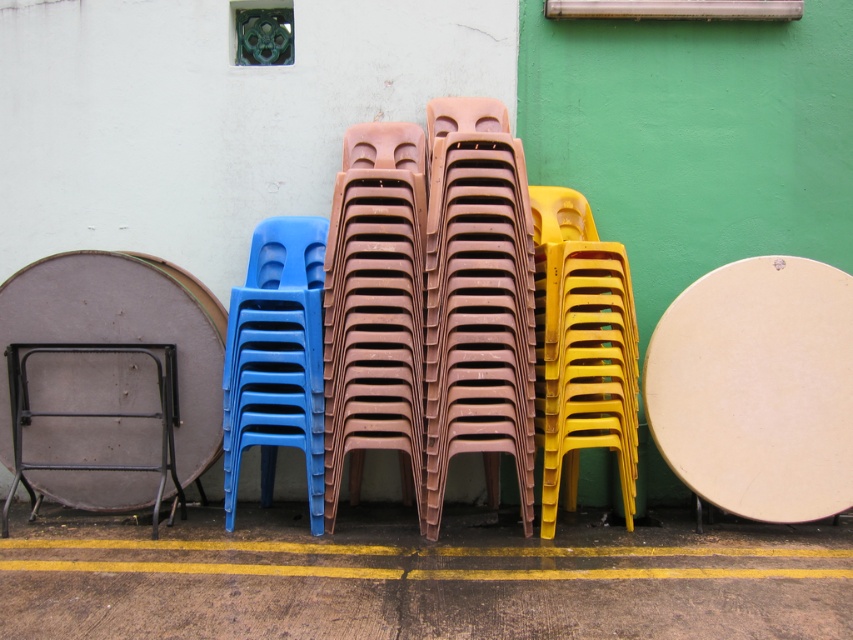
You are organizing a community event and need to set up chairs. You have a limited space and must know the vertical arrangement of the chairs. Which object is positioned higher up between the brown plastic chairs at center and the matte plastic chair at center?

The brown plastic chairs at center are positioned higher up because they are located above the matte plastic chair at center.

You are standing in a storage room and see the yellow plastic chair at right. If you want to move closer to it, which direction should you walk?

Since the yellow plastic chair at right is 11.91 feet away from you, you should walk towards the right side of the room to get closer to it.